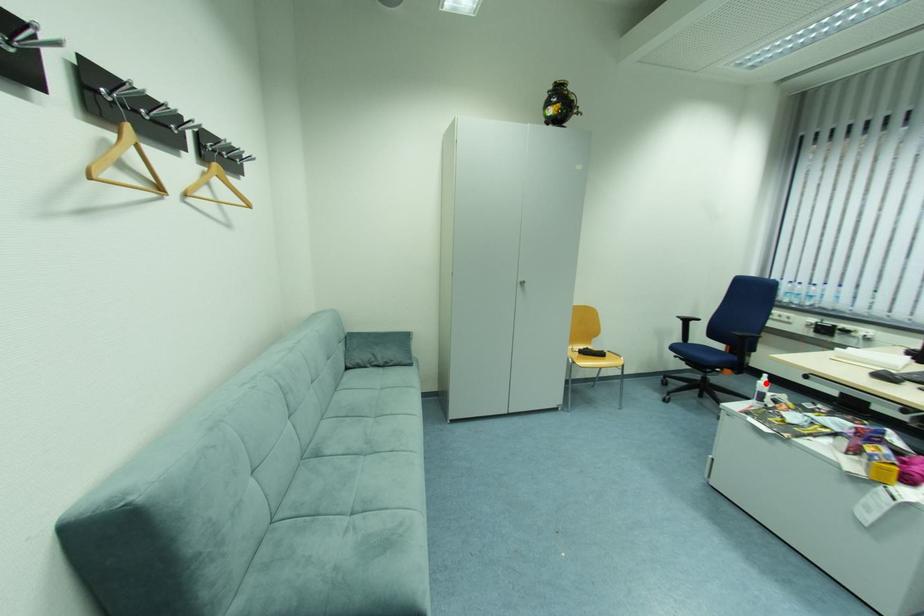
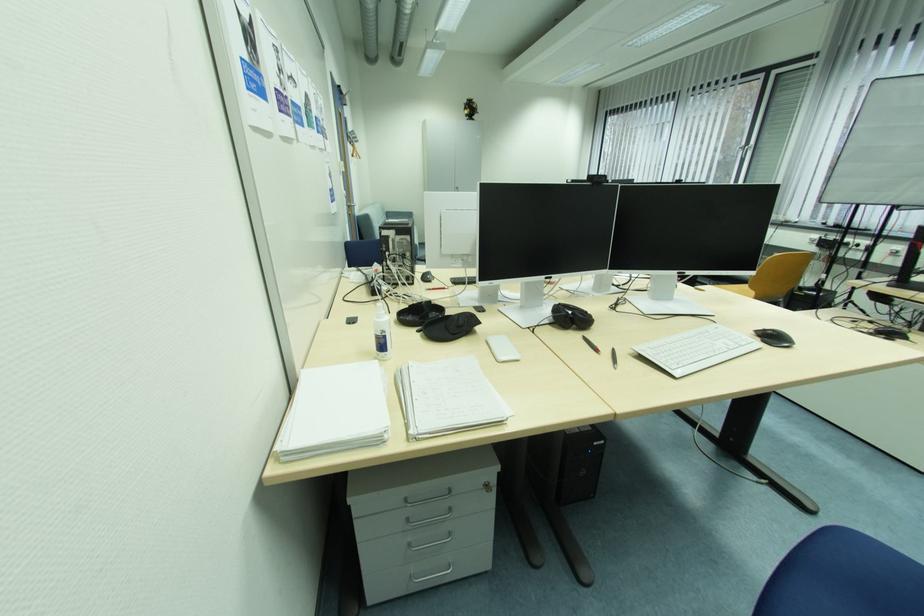
Question: I am providing you with two images of the same scene from different viewpoints. A red point is marked on the first image. At the location where the point appears in image 1, is it still visible in image 2?

Choices:
 (A) Yes
 (B) No

Answer: (B)